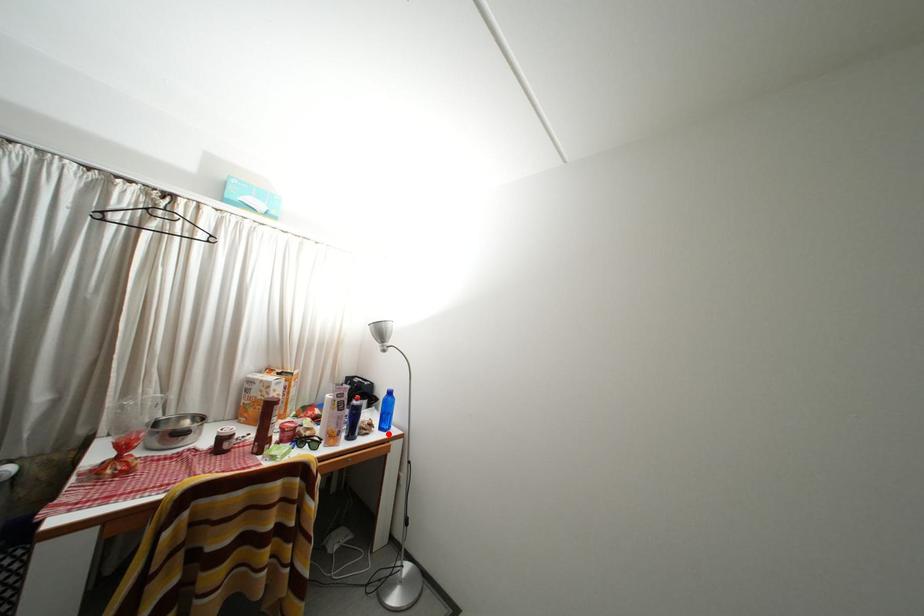
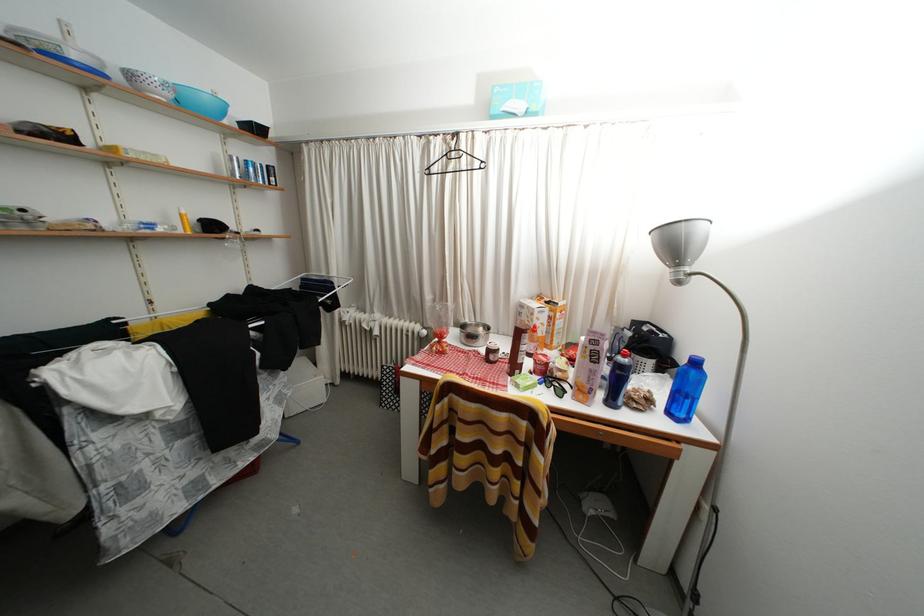
The point at the highlighted location is marked in the first image. Where is the corresponding point in the second image?

(676, 419)